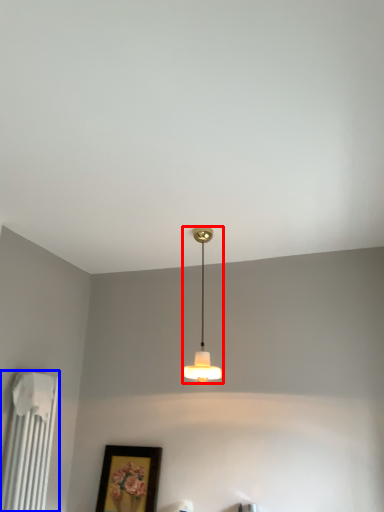
Question: Which point is further to the camera, lamp (highlighted by a red box) or radiator (highlighted by a blue box)?

Choices:
 (A) lamp
 (B) radiator

Answer: (A)